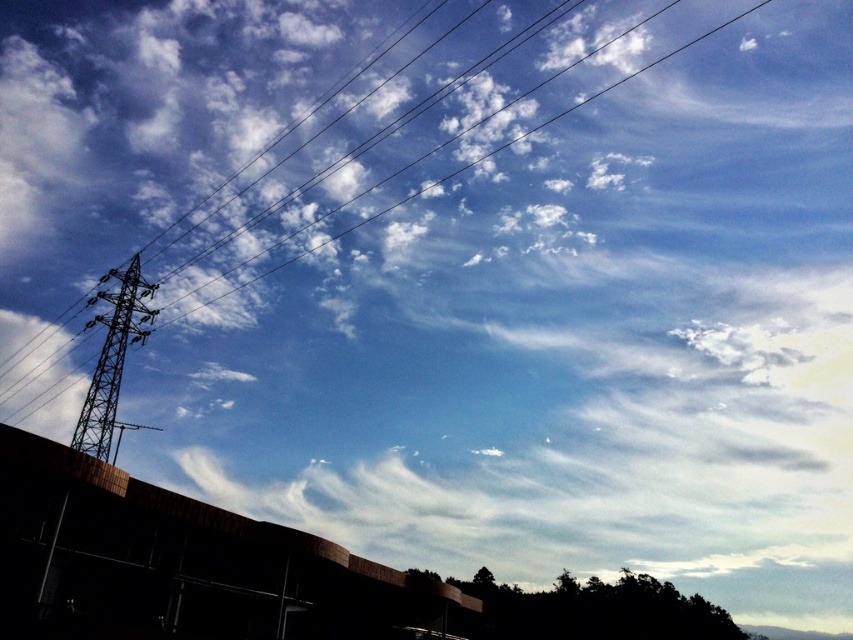
Does metallic structure at left lie behind metallic wire at upper left?

No, it is in front of metallic wire at upper left.

Does point (119, 372) come in front of point (189, 310)?

Yes, it is.

This screenshot has width=853, height=640. Identify the location of metallic structure at left. (112, 356).